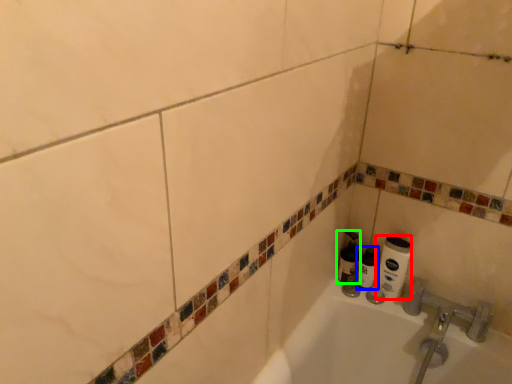
Question: Which object is the farthest from toilet paper (highlighted by a red box)? Choose among these: shaving cream (highlighted by a blue box) or shaving cream (highlighted by a green box).

Choices:
 (A) shaving cream
 (B) shaving cream

Answer: (B)